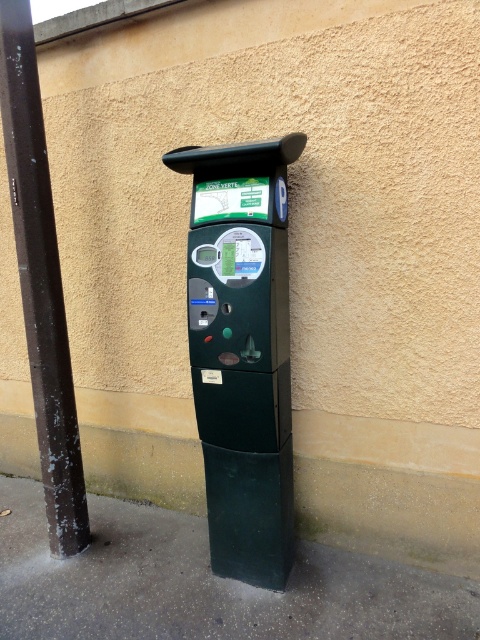
Is green matte trash can at lower center taller than dark brown metal pole at left?

Incorrect, green matte trash can at lower center's height is not larger of dark brown metal pole at left's.

Where is `green matte trash can at lower center`? The image size is (480, 640). green matte trash can at lower center is located at coordinates (389, 486).

Locate an element on the screen. green matte trash can at lower center is located at coordinates (389, 486).

Does dark gray concrete pavement at lower center come in front of green matte trash can at lower center?

Yes, it is.

Which is more to the left, dark gray concrete pavement at lower center or green matte trash can at lower center?

Positioned to the left is dark gray concrete pavement at lower center.

Find the location of a particular element. The image size is (480, 640). dark gray concrete pavement at lower center is located at coordinates (204, 584).

Does dark gray concrete pavement at lower center have a lesser width compared to matte black parking meter at center?

Incorrect, dark gray concrete pavement at lower center's width is not less than matte black parking meter at center's.

Can you confirm if dark gray concrete pavement at lower center is positioned to the right of matte black parking meter at center?

In fact, dark gray concrete pavement at lower center is to the left of matte black parking meter at center.

Between point (396, 621) and point (213, 355), which one is positioned in front?

Point (396, 621) is in front.

Locate an element on the screen. dark gray concrete pavement at lower center is located at coordinates (204, 584).